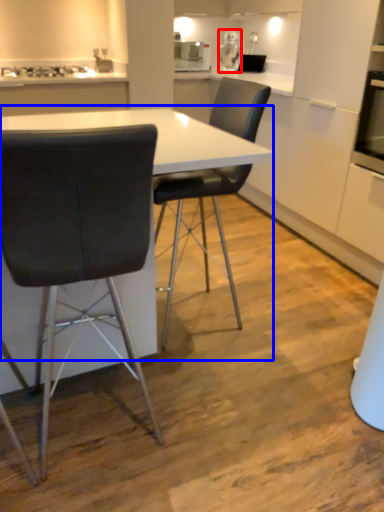
Question: Which of the following is the farthest to the observer, appliance (highlighted by a red box) or table (highlighted by a blue box)?

Choices:
 (A) appliance
 (B) table

Answer: (A)